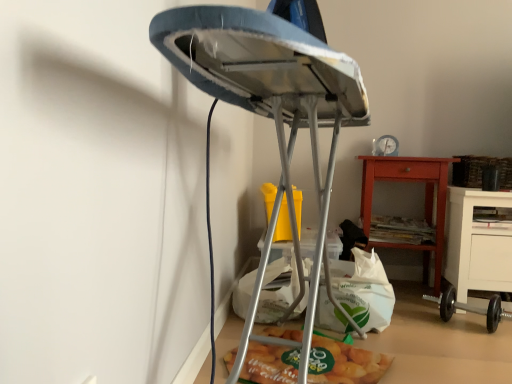
Locate an element on the screen. The height and width of the screenshot is (384, 512). vacant region to the left of black rubber dumbbell at lower right is located at coordinates (418, 327).